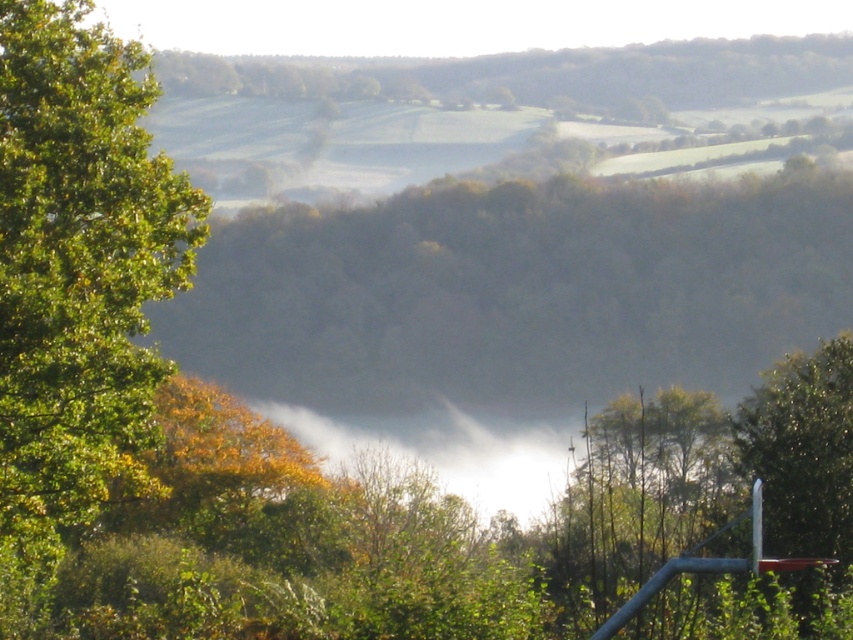
Can you confirm if green leafy tree at center is positioned above green leafy tree at left?

Yes, green leafy tree at center is above green leafy tree at left.

Who is more forward, (660, 282) or (109, 372)?

Positioned in front is point (109, 372).

Locate an element on the screen. green leafy tree at center is located at coordinates (515, 291).